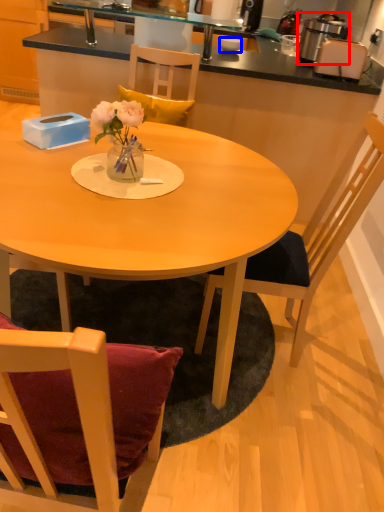
Question: Which of the following is the closest to the observer, kitchen appliance (highlighted by a red box) or coffee cup (highlighted by a blue box)?

Choices:
 (A) kitchen appliance
 (B) coffee cup

Answer: (A)